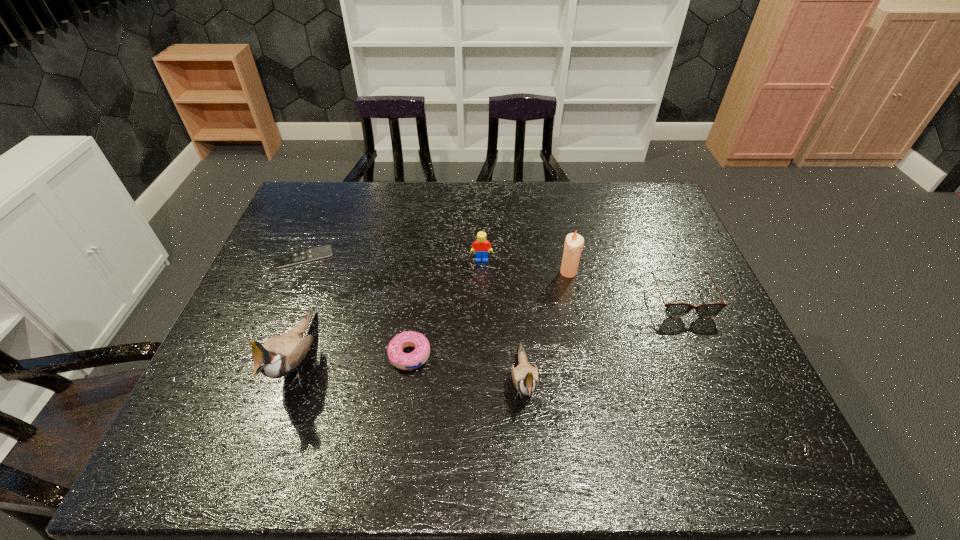
This screenshot has height=540, width=960. I want to click on object located in the near left corner section of the desktop, so click(279, 355).

In the image, there is a desktop. Identify the location of free space at the far edge. This screenshot has width=960, height=540. (434, 204).

Locate an element on the screen. Image resolution: width=960 pixels, height=540 pixels. vacant space at the near edge of the desktop is located at coordinates (546, 409).

In the image, there is a desktop. Where is `vacant space at the left edge`? The height and width of the screenshot is (540, 960). vacant space at the left edge is located at coordinates (295, 295).

Locate an element on the screen. Image resolution: width=960 pixels, height=540 pixels. free region at the right edge is located at coordinates (701, 322).

What are the coordinates of `vacant space at the near left corner of the desktop` in the screenshot? It's located at (209, 384).

In the image, there is a desktop. In order to click on vacant space at the far right corner in this screenshot , I will do `click(667, 220)`.

Locate an element on the screen. free space between the Lego and the shorter bird is located at coordinates (502, 320).

Find the location of `vacant region between the taller bird and the second object from right to left`. vacant region between the taller bird and the second object from right to left is located at coordinates pos(434,315).

The image size is (960, 540). I want to click on vacant space that is in between the fifth object from left to right and the sixth object from left to right, so click(546, 326).